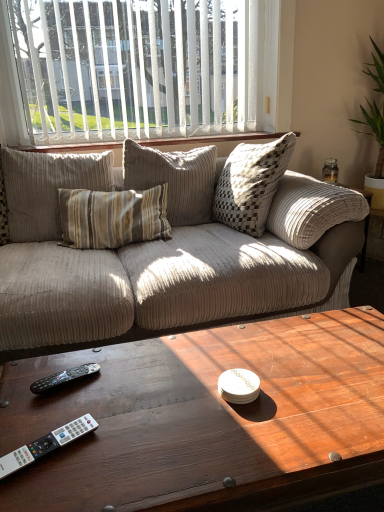
Question: Would you say beige corduroy pillow at center is a long distance from white vertical blinds at upper center?

Choices:
 (A) yes
 (B) no

Answer: (B)

Question: Are beige corduroy pillow at center and white vertical blinds at upper center beside each other?

Choices:
 (A) yes
 (B) no

Answer: (B)

Question: From a real-world perspective, is beige corduroy pillow at center physically above white vertical blinds at upper center?

Choices:
 (A) yes
 (B) no

Answer: (B)

Question: Can you confirm if beige corduroy pillow at center is taller than white vertical blinds at upper center?

Choices:
 (A) no
 (B) yes

Answer: (A)

Question: Is beige corduroy pillow at center shorter than white vertical blinds at upper center?

Choices:
 (A) no
 (B) yes

Answer: (B)

Question: Can you confirm if beige corduroy pillow at center is thinner than white vertical blinds at upper center?

Choices:
 (A) no
 (B) yes

Answer: (A)

Question: Could you tell me if black plastic remote control at lower left, which is the second remote control from bottom to top, is turned towards beige corduroy pillow at center?

Choices:
 (A) yes
 (B) no

Answer: (B)

Question: Is black plastic remote control at lower left, placed as the 1th remote control when sorted from top to bottom, at the left side of beige corduroy pillow at center?

Choices:
 (A) yes
 (B) no

Answer: (B)

Question: Is black plastic remote control at lower left, placed as the 1th remote control when sorted from top to bottom, closer to camera compared to beige corduroy pillow at center?

Choices:
 (A) no
 (B) yes

Answer: (B)

Question: Considering the relative sizes of black plastic remote control at lower left, which is the second remote control from bottom to top, and beige corduroy pillow at center in the image provided, is black plastic remote control at lower left, which is the second remote control from bottom to top, thinner than beige corduroy pillow at center?

Choices:
 (A) no
 (B) yes

Answer: (B)

Question: Are black plastic remote control at lower left, the 2th remote control in the front-to-back sequence, and beige corduroy pillow at center making contact?

Choices:
 (A) yes
 (B) no

Answer: (B)

Question: Is beige corduroy pillow at center at the back of black plastic remote control at lower left, which appears as the 1th remote control when viewed from the back?

Choices:
 (A) yes
 (B) no

Answer: (B)

Question: Can you confirm if beige corduroy pillow at center is wider than white plastic remote control at lower left, which is counted as the first remote control, starting from the bottom?

Choices:
 (A) yes
 (B) no

Answer: (A)